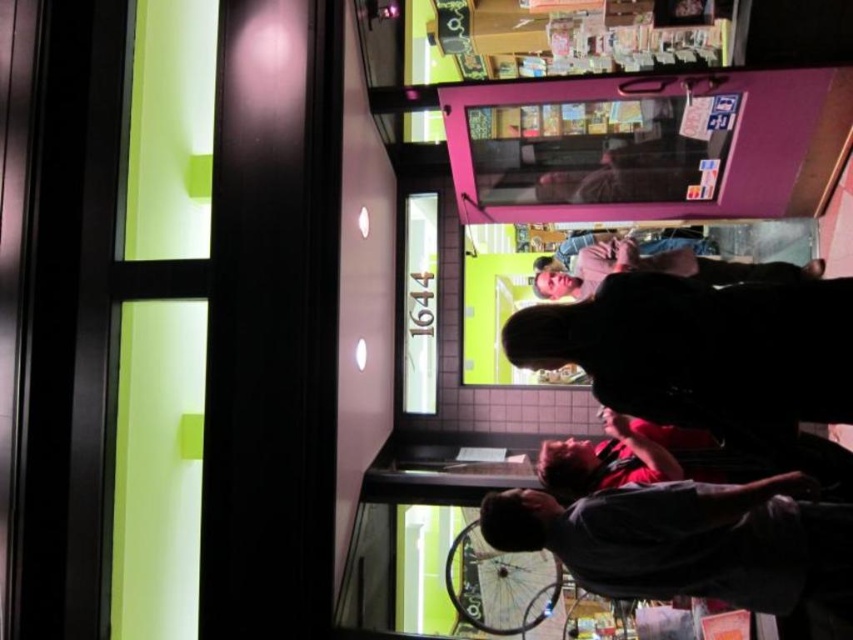
You are standing inside the building and looking through the glass door. You see a dark gray shirt at lower right and a matte pink shirt at center. Which shirt is positioned more to the left?

The dark gray shirt at lower right is positioned more to the left than the matte pink shirt at center.

You are a customer entering through the glass door and see both the dark matte jacket at center and the matte pink shirt at center displayed in the store. Which item is positioned lower on the display rack?

The dark matte jacket at center is located below the matte pink shirt at center, so it is positioned lower on the display rack.

You are standing inside the building and see the dark matte jacket at center and the dark gray shirt at lower right. Which clothing item is taller?

The dark matte jacket at center is taller than the dark gray shirt at lower right.